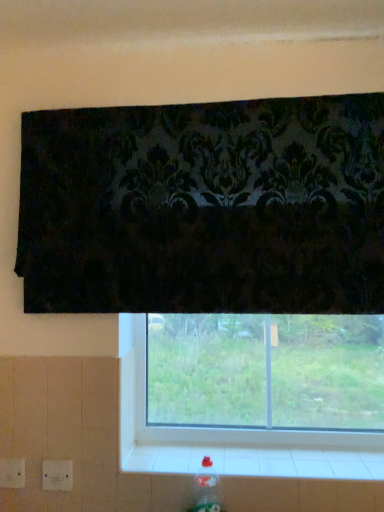
Question: Relative to clear plastic bottle at lower right, is white tile at lower center in front or behind?

Choices:
 (A) behind
 (B) front

Answer: (A)

Question: Is point 327,466 closer or farther from the camera than point 215,471?

Choices:
 (A) closer
 (B) farther

Answer: (A)

Question: Which is farther from the transparent glass window at center?

Choices:
 (A) clear plastic bottle at lower right
 (B) white tile at lower center

Answer: (A)

Question: Which object is the closest to the clear plastic bottle at lower right?

Choices:
 (A) transparent glass window at center
 (B) white tile at lower center

Answer: (B)